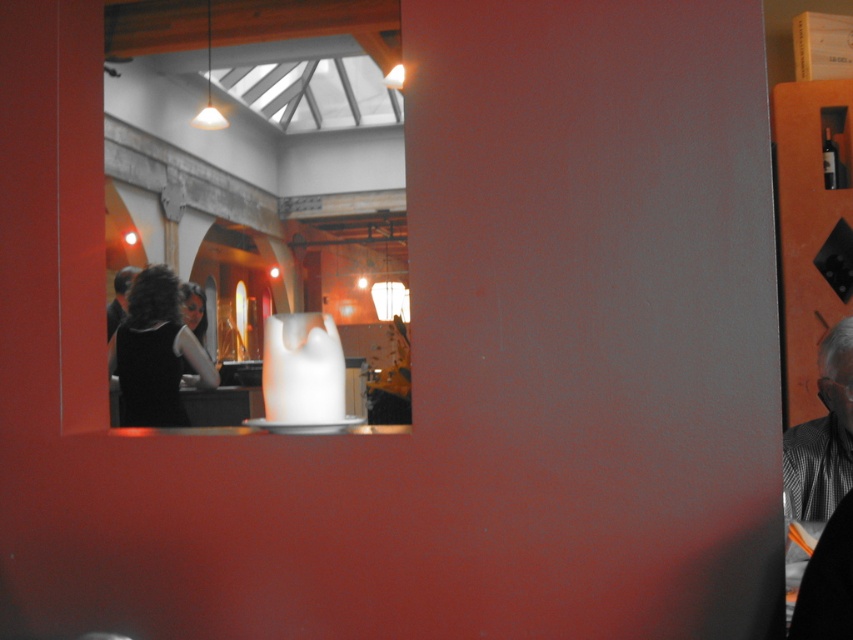
Who is more forward, (809, 467) or (109, 321)?

Point (809, 467) is more forward.

This screenshot has width=853, height=640. Find the location of `gray checkered shirt at right`. gray checkered shirt at right is located at coordinates (822, 497).

Is black matte dress at lower left below dark brown hair at left?

Yes, black matte dress at lower left is below dark brown hair at left.

Does black matte dress at lower left appear on the left side of dark brown hair at left?

Incorrect, black matte dress at lower left is not on the left side of dark brown hair at left.

Does point (170, 337) lie in front of point (111, 333)?

Yes, point (170, 337) is closer to viewer.

Identify the location of black matte dress at lower left. (155, 353).

Can you confirm if gray checkered shirt at right is positioned below black matte dress at lower left?

Yes, gray checkered shirt at right is below black matte dress at lower left.

Is gray checkered shirt at right to the right of black matte dress at lower left from the viewer's perspective?

Yes, gray checkered shirt at right is to the right of black matte dress at lower left.

Is point (807, 470) farther from viewer compared to point (177, 280)?

No, (807, 470) is closer to viewer.

This screenshot has height=640, width=853. Find the location of `gray checkered shirt at right`. gray checkered shirt at right is located at coordinates (822, 497).